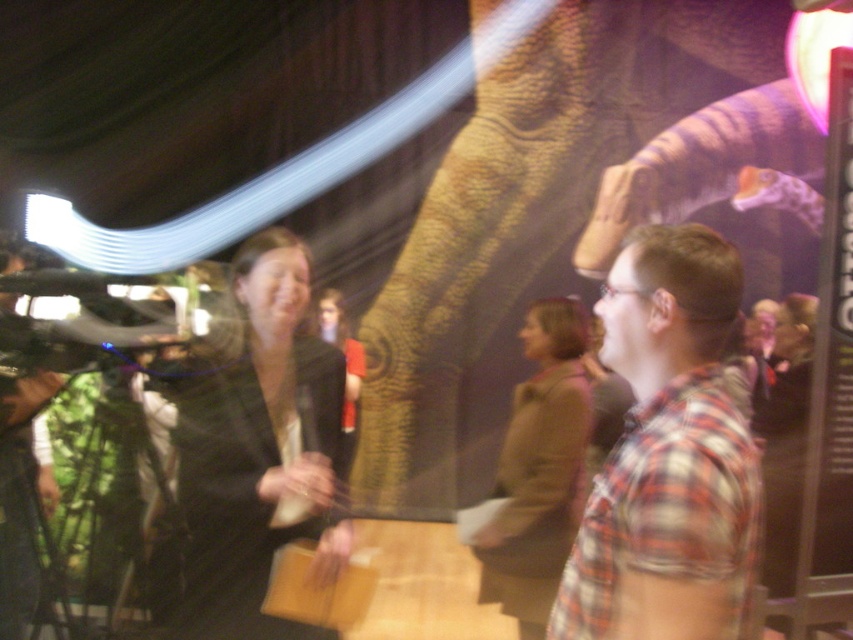
In the scene shown: You are a photographer at the event and need to capture a clear photo of both the black fabric dress at center and the brown wool sweater at center. Since your camera can only focus on one width at a time, which object should you adjust the focus width for to ensure both are in focus?

The black fabric dress at center might be wider than brown wool sweater at center, so adjusting the focus width for the wider black fabric dress at center would ensure both are in focus.

You are attending an event and want to take a photo of the black fabric dress at center without the brown textured trunk at center blocking the view. Is this possible from your current position?

The brown textured trunk at center is further to the viewer than the black fabric dress at center, so it is blocking the view. You would need to move to a position where the trunk is no longer between you and the dress to take the photo without obstruction.